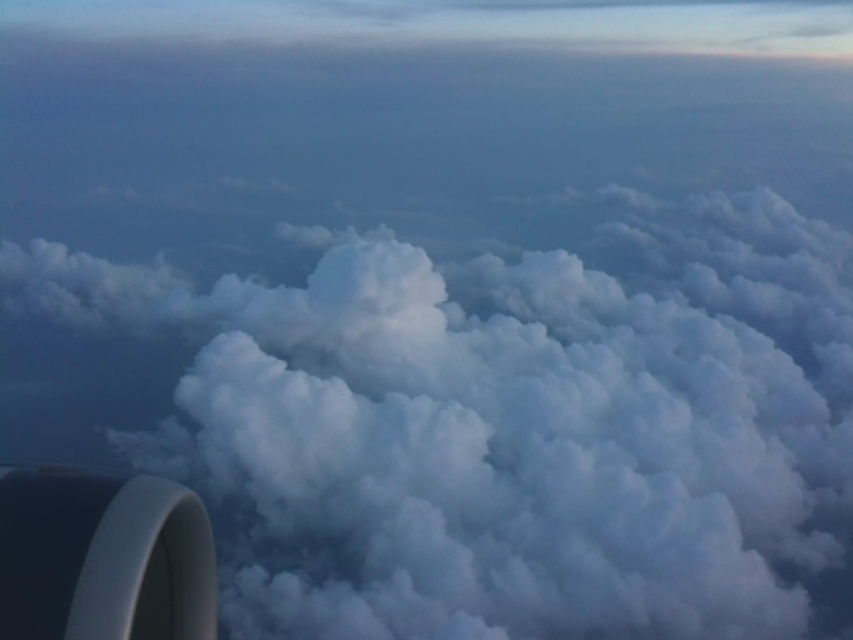
You are a pilot looking out of the airplane window and see the white fluffy cloud at center and the white matte engine at bottom left. Which object appears larger in the view?

The white fluffy cloud at center appears larger than the white matte engine at bottom left.

You are a passenger looking out the airplane window. You notice the white fluffy cloud at center and the white matte engine at bottom left. Which object appears closer to you?

The white fluffy cloud at center appears closer because the white matte engine at bottom left is behind it.

You are a pilot observing the scene from the cockpit. You notice the white fluffy cloud at center and the white matte engine at bottom left. Based on their sizes in the view, which object appears larger?

→ The white fluffy cloud at center appears larger than the white matte engine at bottom left because it is taller than the engine in the view.